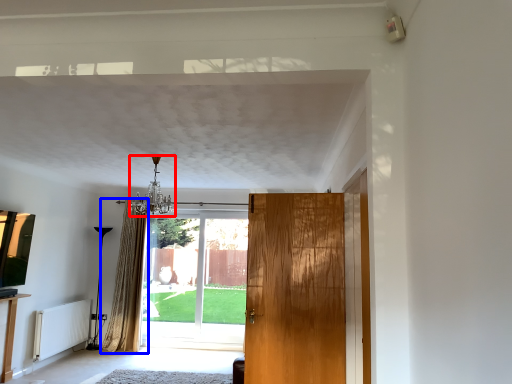
Question: Which of the following is the closest to the observer, light fixture (highlighted by a red box) or curtain (highlighted by a blue box)?

Choices:
 (A) light fixture
 (B) curtain

Answer: (A)